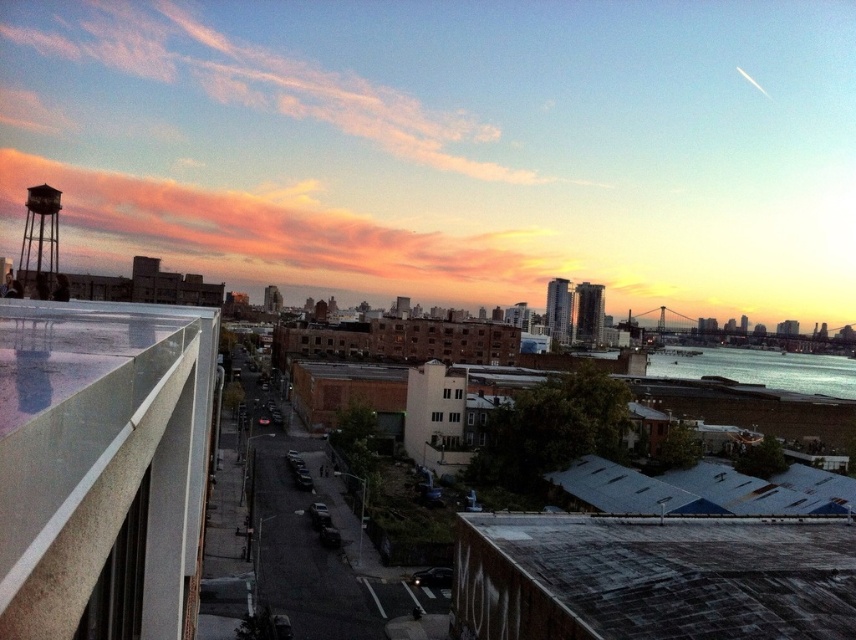
In the scene shown: You are standing on the rooftop with the white railing and want to look at the transparent glass balcony at upper left. Based on its 2D location coordinates, in which general direction should you turn your head to see it?

The transparent glass balcony at upper left is located at coordinates point (x=98, y=454), which places it in the upper left area of the image. Therefore, you should turn your head to the upper left direction to see it.

You are standing on the rooftop with the white railing and looking out. You see the blue water at lower right and the metallic water tower at upper left. Which object is located to the right side of the other?

The blue water at lower right is located to the right of the metallic water tower at upper left.

You are standing on the rooftop with the white railing and want to look out towards the transparent glass balcony at upper left and the blue water at lower right. Which object is closer to the edge of the rooftop?

The transparent glass balcony at upper left is closer to the edge of the rooftop than the blue water at lower right because it is shorter in height compared to the blue water at lower right.